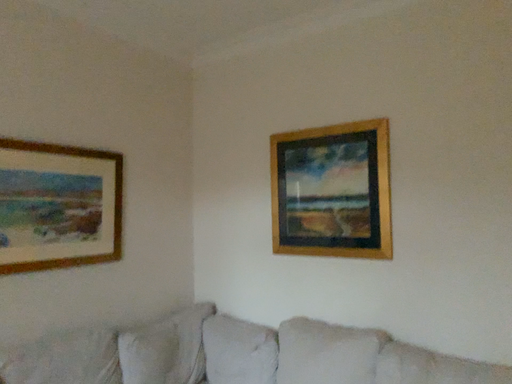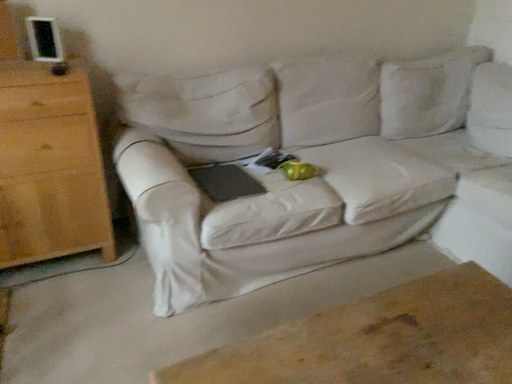
Question: How did the camera likely rotate when shooting the video?

Choices:
 (A) rotated right
 (B) rotated left

Answer: (B)